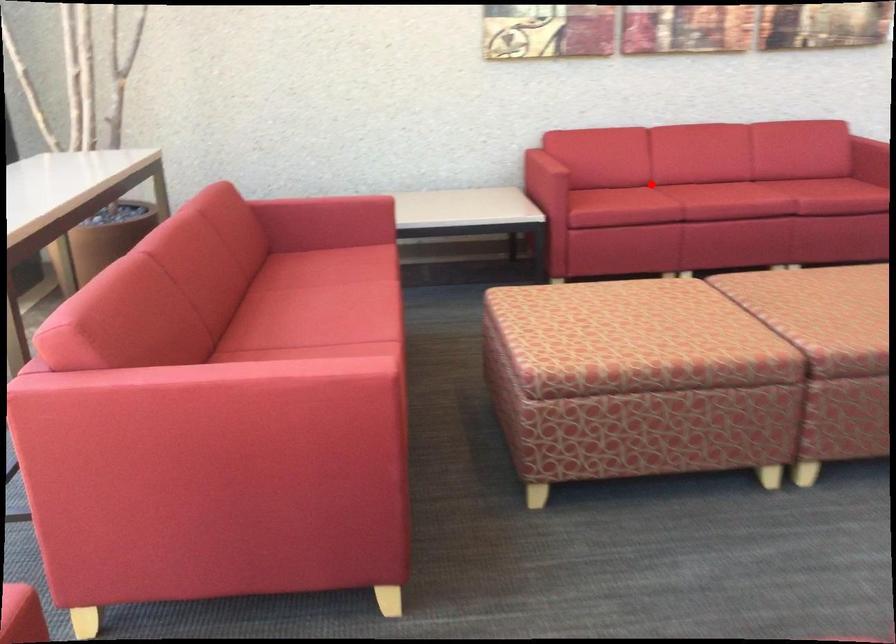
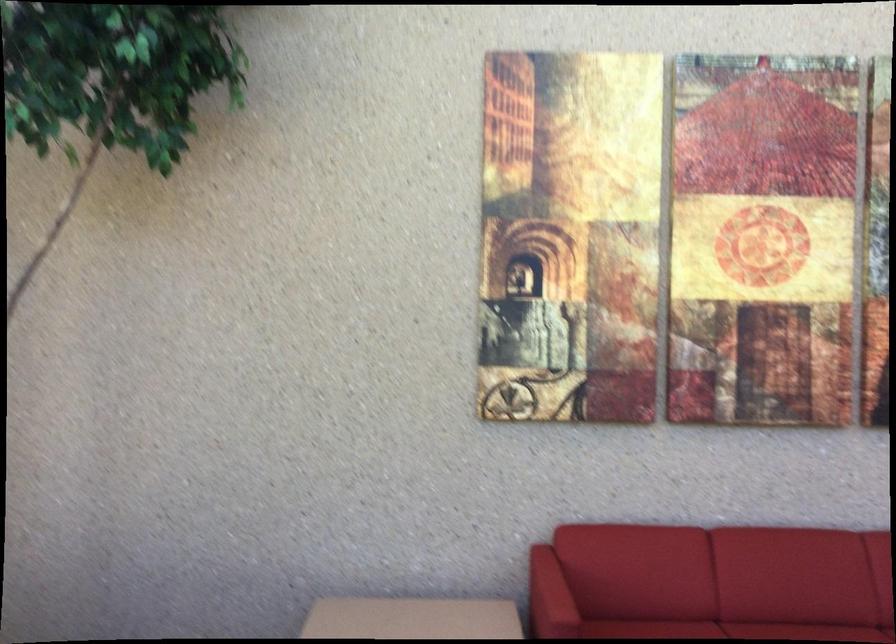
Find the pixel in the second image that matches the highlighted location in the first image.

(727, 630)